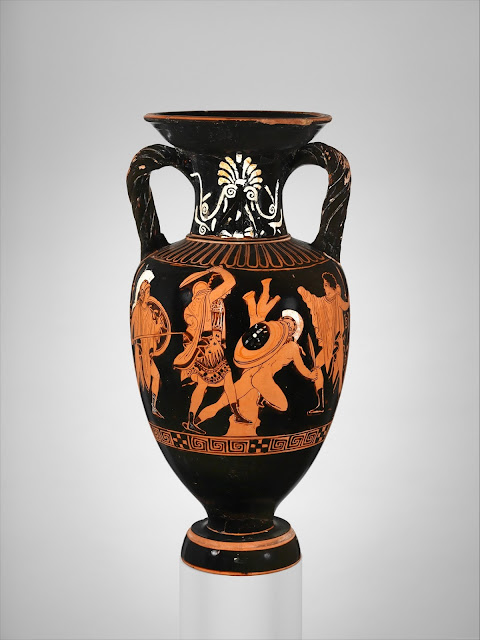
This screenshot has height=640, width=480. I want to click on handles, so pyautogui.click(x=337, y=202), pyautogui.click(x=135, y=166).